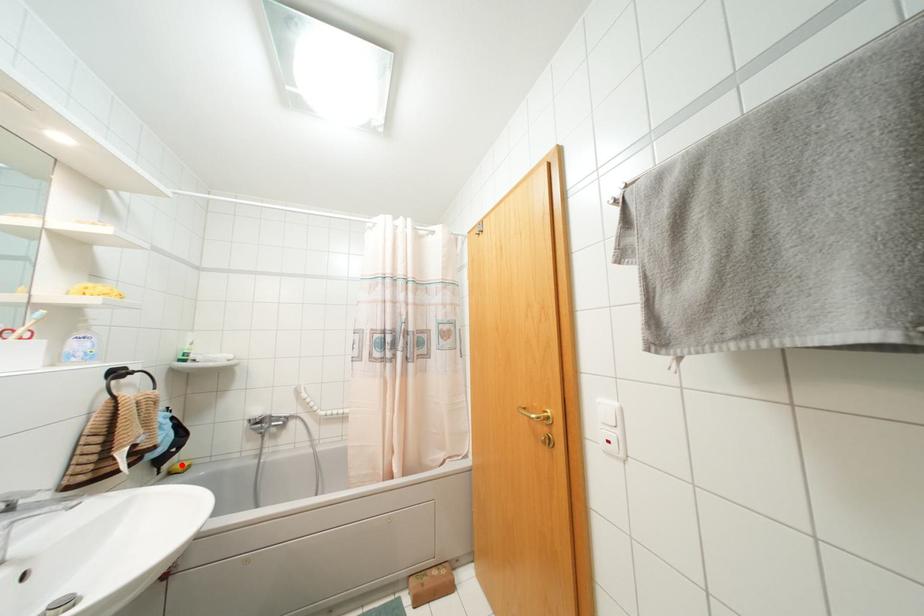
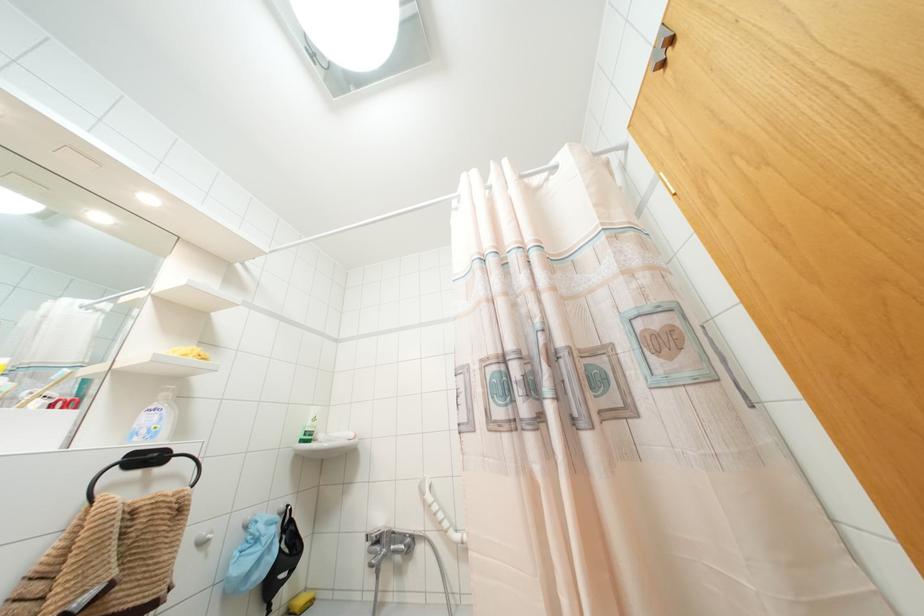
The point at the highlighted location is marked in the first image. Where is the corresponding point in the second image?

(299, 601)